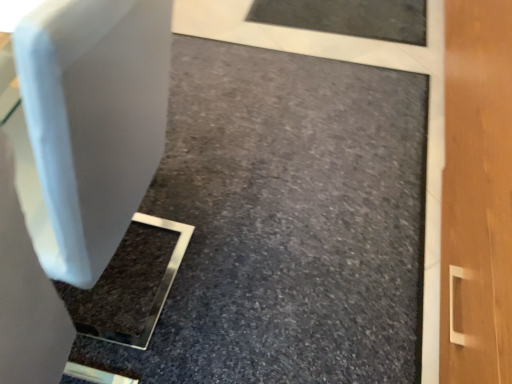
I want to click on free point below matte white concrete at center (from a real-world perspective), so click(298, 185).